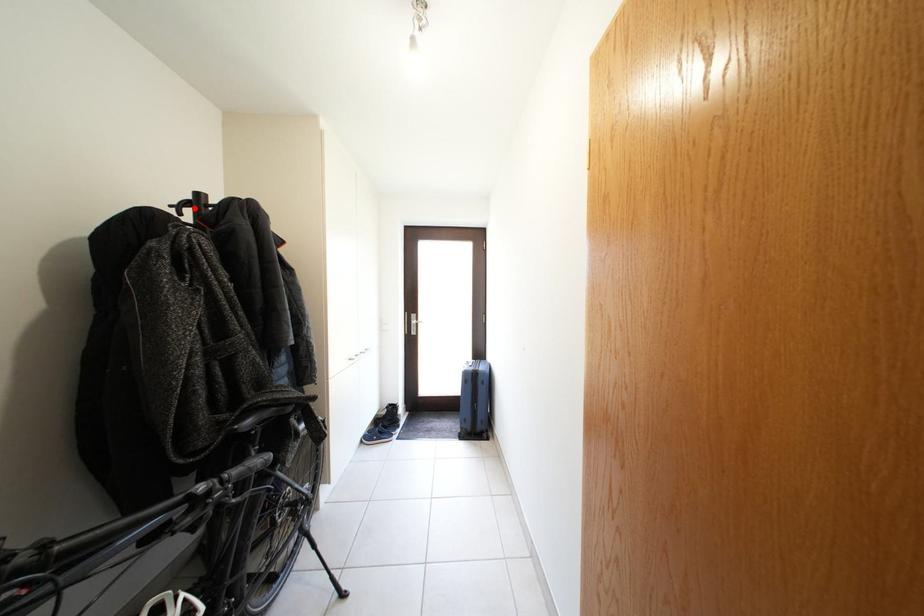
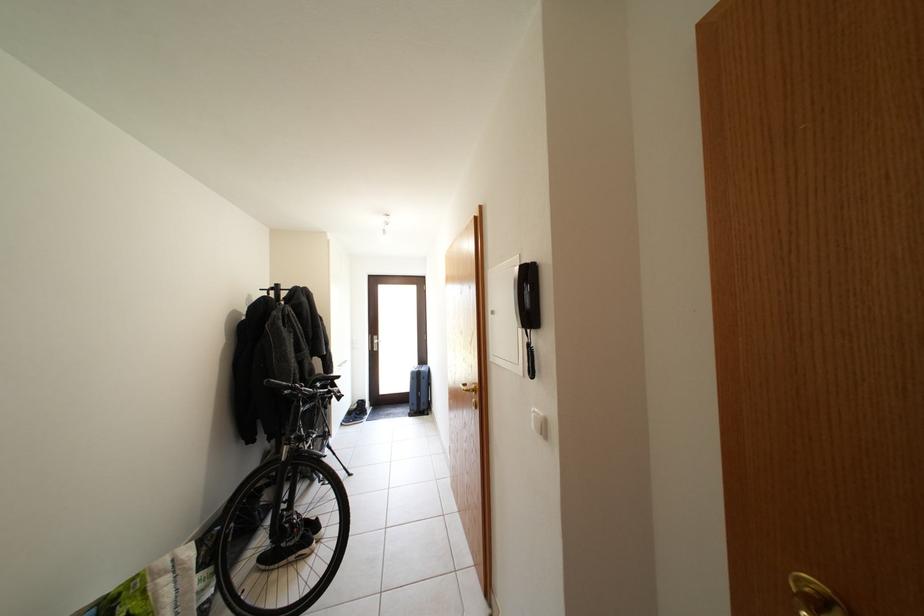
The point at the highlighted location is marked in the first image. Where is the corresponding point in the second image?

(281, 294)